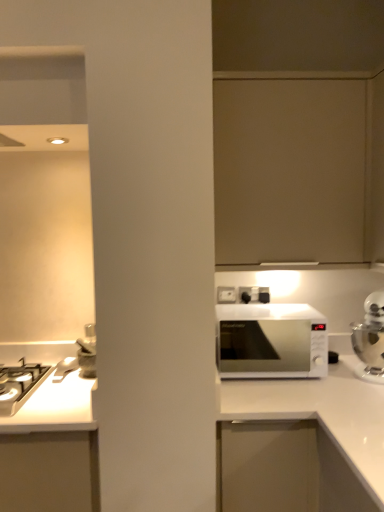
Question: Is silver metallic kettle at right closer to camera compared to white plastic electric outlet at upper center?

Choices:
 (A) yes
 (B) no

Answer: (A)

Question: Can you confirm if silver metallic kettle at right is bigger than white plastic electric outlet at upper center?

Choices:
 (A) no
 (B) yes

Answer: (B)

Question: From the image's perspective, is silver metallic kettle at right located beneath white plastic electric outlet at upper center?

Choices:
 (A) no
 (B) yes

Answer: (B)

Question: Is silver metallic kettle at right taller than white plastic electric outlet at upper center?

Choices:
 (A) no
 (B) yes

Answer: (B)

Question: Can you confirm if silver metallic kettle at right is positioned to the right of white plastic electric outlet at upper center?

Choices:
 (A) yes
 (B) no

Answer: (A)

Question: Considering the positions of white glossy microwave at center and matte beige cabinet at upper center in the image, is white glossy microwave at center taller or shorter than matte beige cabinet at upper center?

Choices:
 (A) tall
 (B) short

Answer: (B)

Question: Is white glossy microwave at center to the left or to the right of matte beige cabinet at upper center in the image?

Choices:
 (A) right
 (B) left

Answer: (B)

Question: Is white glossy microwave at center spatially inside matte beige cabinet at upper center, or outside of it?

Choices:
 (A) outside
 (B) inside

Answer: (A)

Question: Relative to matte beige cabinet at upper center, is white glossy microwave at center in front or behind?

Choices:
 (A) behind
 (B) front

Answer: (A)

Question: From a real-world perspective, relative to white glossy gas stove at left, is matte beige cabinet at upper center vertically above or below?

Choices:
 (A) below
 (B) above

Answer: (B)

Question: Is matte beige cabinet at upper center to the left or to the right of white glossy gas stove at left in the image?

Choices:
 (A) left
 (B) right

Answer: (B)

Question: From the image's perspective, is matte beige cabinet at upper center above or below white glossy gas stove at left?

Choices:
 (A) above
 (B) below

Answer: (A)

Question: Does point (253, 245) appear closer or farther from the camera than point (13, 404)?

Choices:
 (A) closer
 (B) farther

Answer: (B)

Question: In the image, is white plastic electric outlet at upper center positioned in front of or behind white glossy microwave at right?

Choices:
 (A) front
 (B) behind

Answer: (B)

Question: Is white plastic electric outlet at upper center spatially inside white glossy microwave at right, or outside of it?

Choices:
 (A) outside
 (B) inside

Answer: (A)